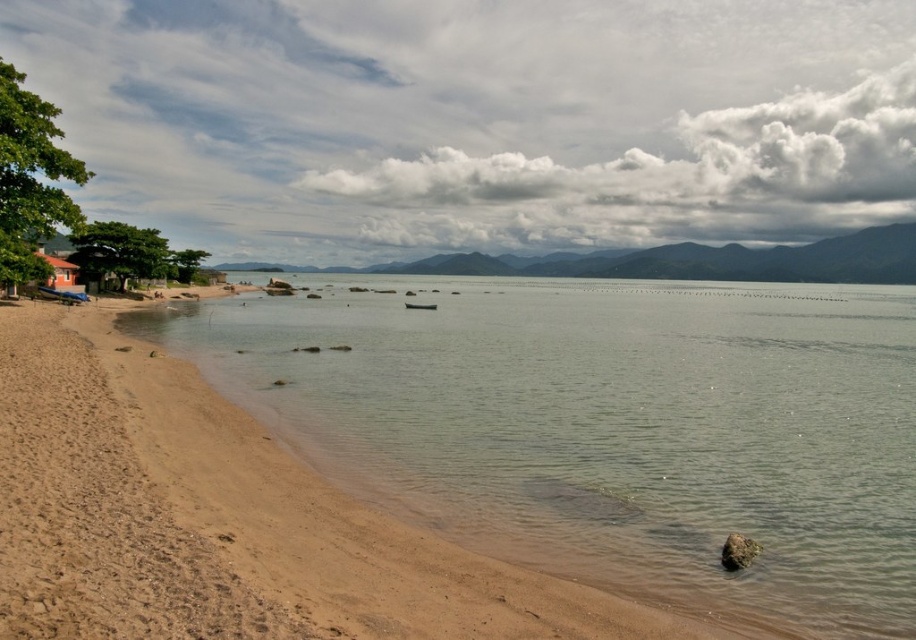
Can you confirm if clear water at beach left is wider than brown wooden hut at lower left?

Yes, clear water at beach left is wider than brown wooden hut at lower left.

Is clear water at beach left to the left of brown wooden hut at lower left from the viewer's perspective?

In fact, clear water at beach left is to the right of brown wooden hut at lower left.

What do you see at coordinates (609, 426) in the screenshot?
I see `clear water at beach left` at bounding box center [609, 426].

Where is `clear water at beach left`? The width and height of the screenshot is (916, 640). clear water at beach left is located at coordinates (609, 426).